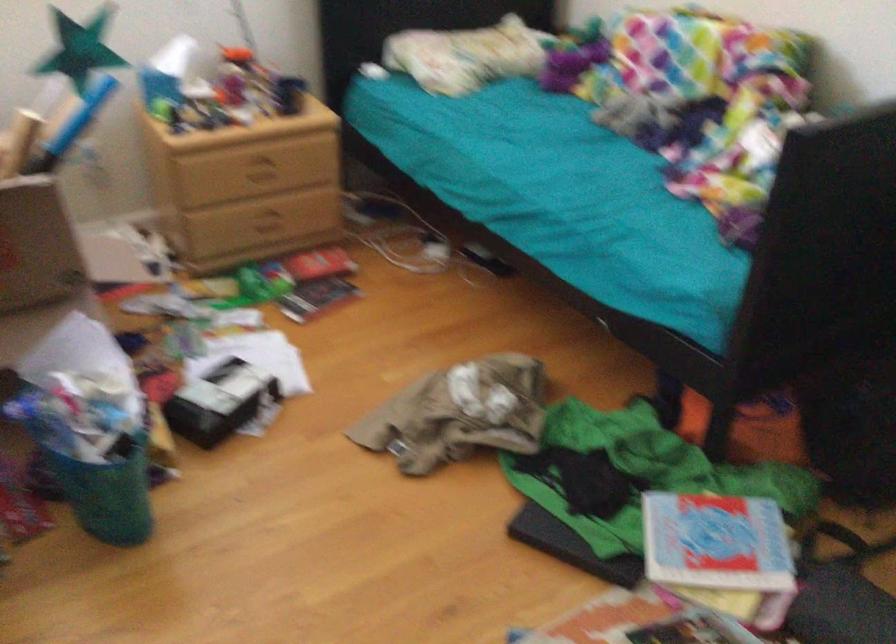
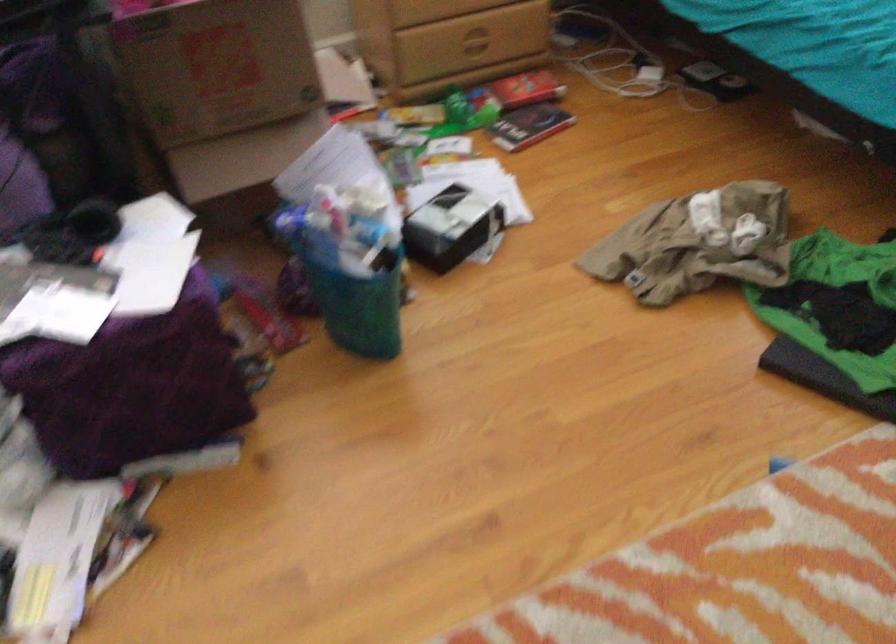
Where in the second image is the point corresponding to point 93,480 from the first image?

(352, 299)